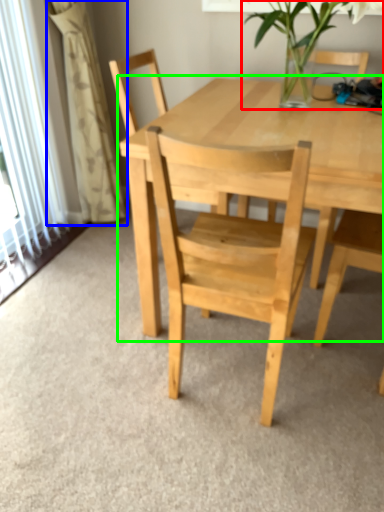
Question: Which object is positioned closest to houseplant (highlighted by a red box)? Select from curtain (highlighted by a blue box) and round table (highlighted by a green box).

Choices:
 (A) curtain
 (B) round table

Answer: (B)